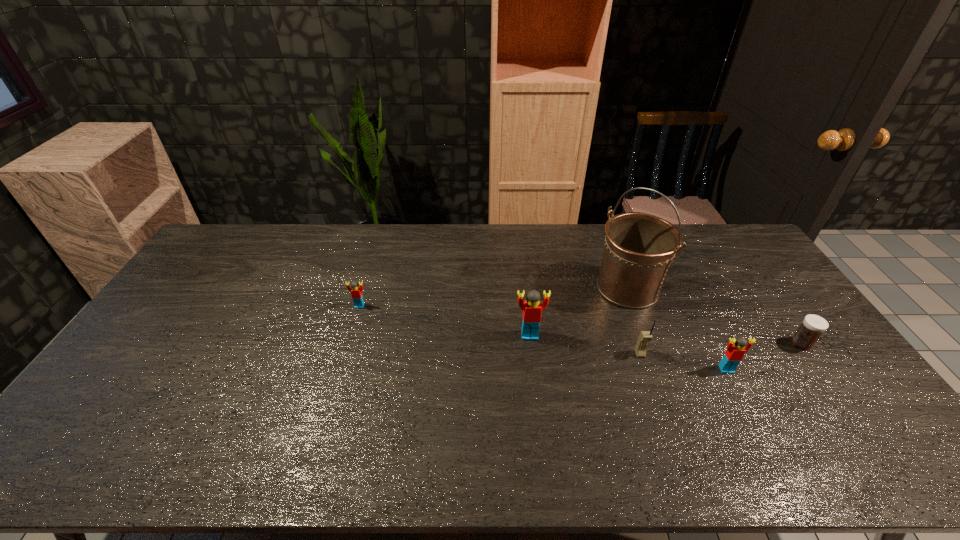
This screenshot has width=960, height=540. I want to click on free space between the nearest Lego and the bucket, so click(677, 329).

Locate an element on the screen. The width and height of the screenshot is (960, 540). object that is the fourth closest to the cellular telephone is located at coordinates (813, 326).

Select which object appears as the second closest to the rightmost object. Please provide its 2D coordinates. Your answer should be formatted as a tuple, i.e. [(x, y)], where the tuple contains the x and y coordinates of a point satisfying the conditions above.

[(639, 248)]

Identify which Lego is the closest to the cellular telephone. Please provide its 2D coordinates. Your answer should be formatted as a tuple, i.e. [(x, y)], where the tuple contains the x and y coordinates of a point satisfying the conditions above.

[(734, 354)]

Point out which Lego is positioned as the second nearest to the nearest object. Please provide its 2D coordinates. Your answer should be formatted as a tuple, i.e. [(x, y)], where the tuple contains the x and y coordinates of a point satisfying the conditions above.

[(356, 291)]

The height and width of the screenshot is (540, 960). In order to click on free location that satisfies the following two spatial constraints: 1. on the face of the second tallest object; 2. on the right side of the rightmost object in this screenshot , I will do `click(531, 343)`.

Locate an element on the screen. The image size is (960, 540). vacant space that satisfies the following two spatial constraints: 1. on the face of the fifth shortest object; 2. on the left side of the rightmost object is located at coordinates (531, 343).